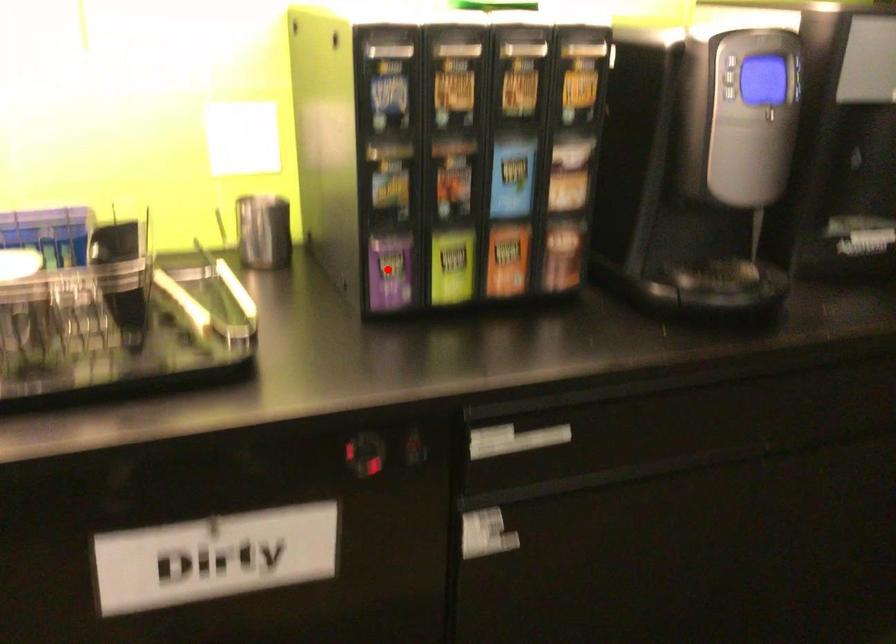
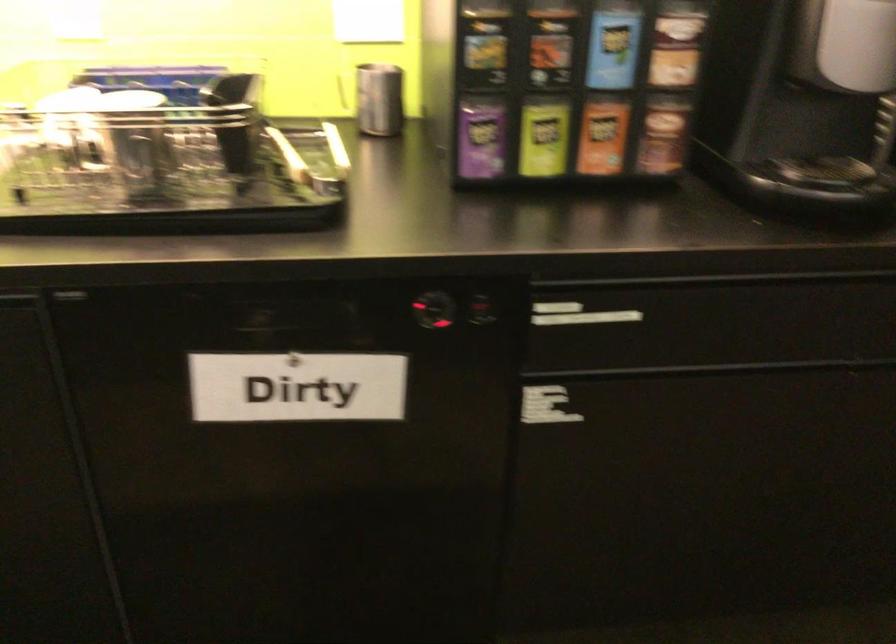
Find the pixel in the second image that matches the highlighted location in the first image.

(479, 138)